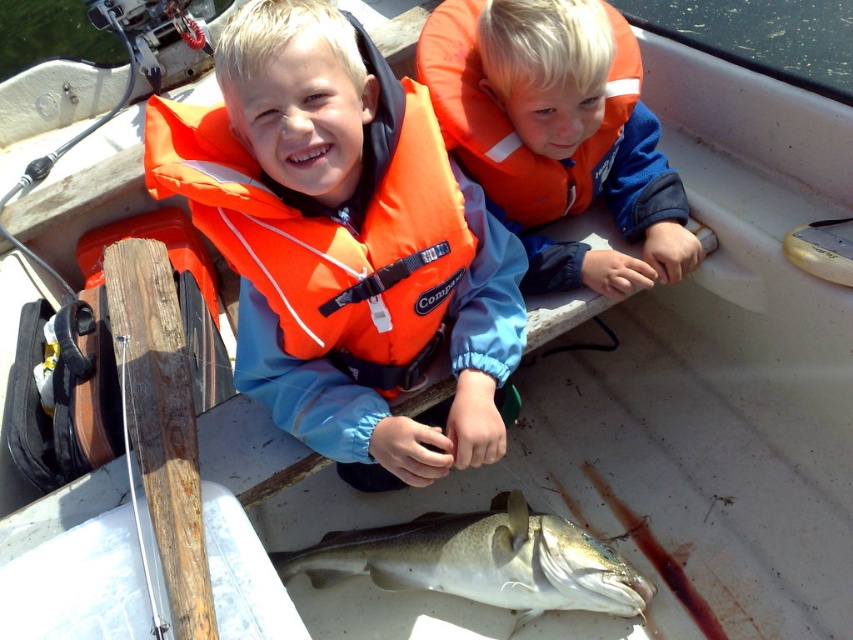
Can you confirm if speckled white fish at center is positioned below orange life jacket at upper center?

Indeed, speckled white fish at center is positioned under orange life jacket at upper center.

Image resolution: width=853 pixels, height=640 pixels. What do you see at coordinates (480, 561) in the screenshot? I see `speckled white fish at center` at bounding box center [480, 561].

The height and width of the screenshot is (640, 853). What are the coordinates of `speckled white fish at center` in the screenshot? It's located at (480, 561).

Between orange life vest at center and orange life jacket at upper center, which one is positioned higher?

Positioned higher is orange life jacket at upper center.

Can you confirm if orange life vest at center is bigger than orange life jacket at upper center?

Indeed, orange life vest at center has a larger size compared to orange life jacket at upper center.

Where is `orange life vest at center`? This screenshot has width=853, height=640. orange life vest at center is located at coordinates (345, 244).

Image resolution: width=853 pixels, height=640 pixels. Describe the element at coordinates (345, 244) in the screenshot. I see `orange life vest at center` at that location.

Measure the distance between orange life vest at center and camera.

orange life vest at center and camera are 4.12 feet apart from each other.

At what (x,y) coordinates should I click in order to perform the action: click on orange life vest at center. Please return your answer as a coordinate pair (x, y). This screenshot has height=640, width=853. Looking at the image, I should click on (345, 244).